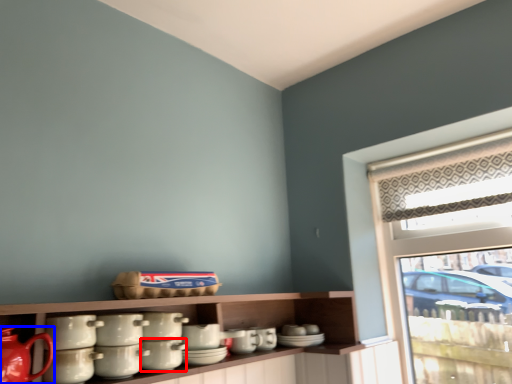
Question: Which object appears farthest to the camera in this image, tableware (highlighted by a red box) or tea pot (highlighted by a blue box)?

Choices:
 (A) tableware
 (B) tea pot

Answer: (A)